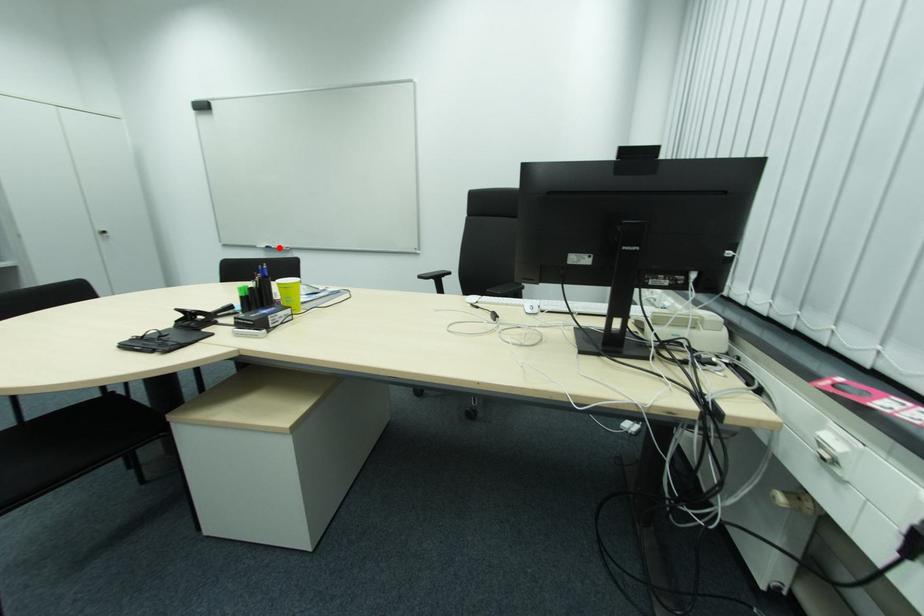
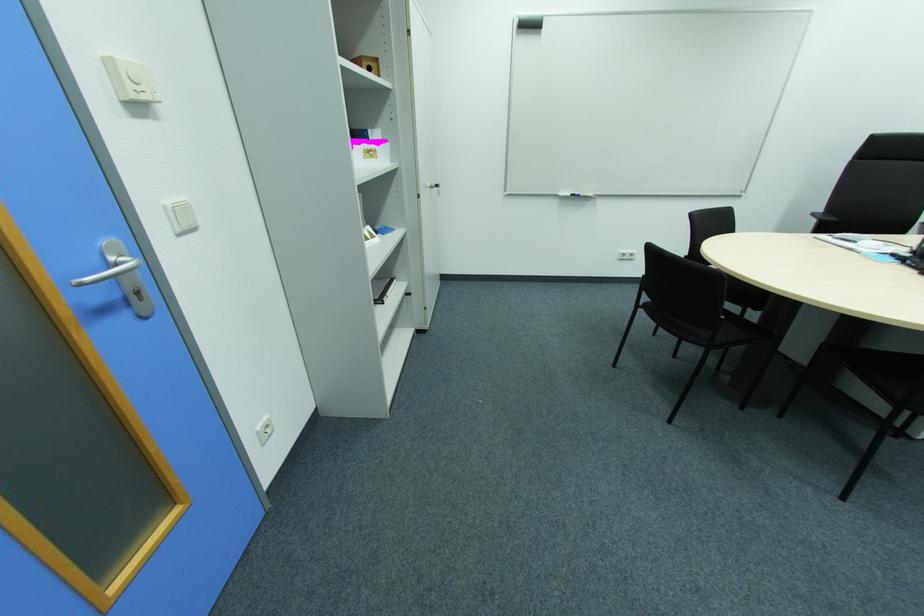
The point at the highlighted location is marked in the first image. Where is the corresponding point in the second image?

(588, 195)